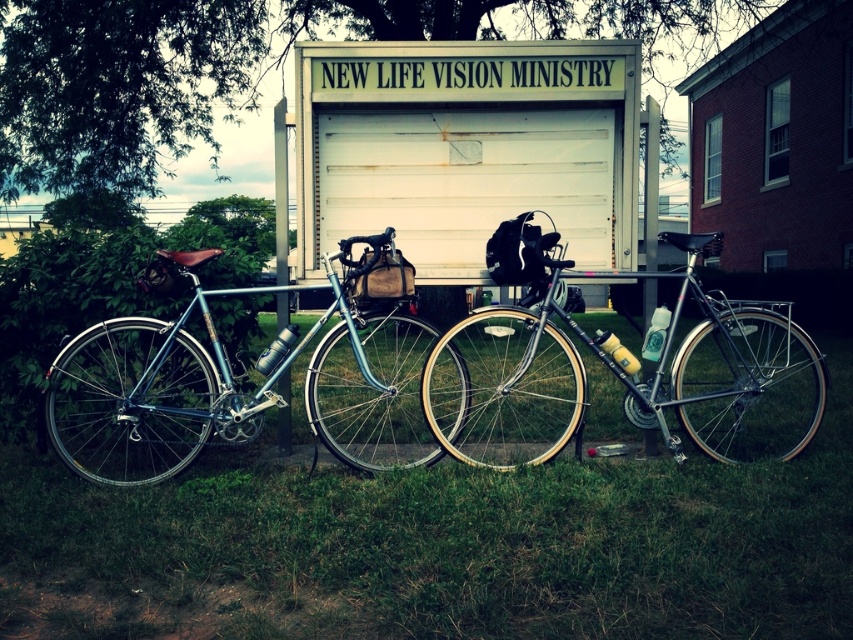
You are standing in front of the garage door and want to place a 5 meter long ladder on the ground. Is there enough space between you and the green grass at lower center to fit the ladder?

The green grass at lower center is 4.51 meters away from viewer, so the ladder is longer than the available space. It won